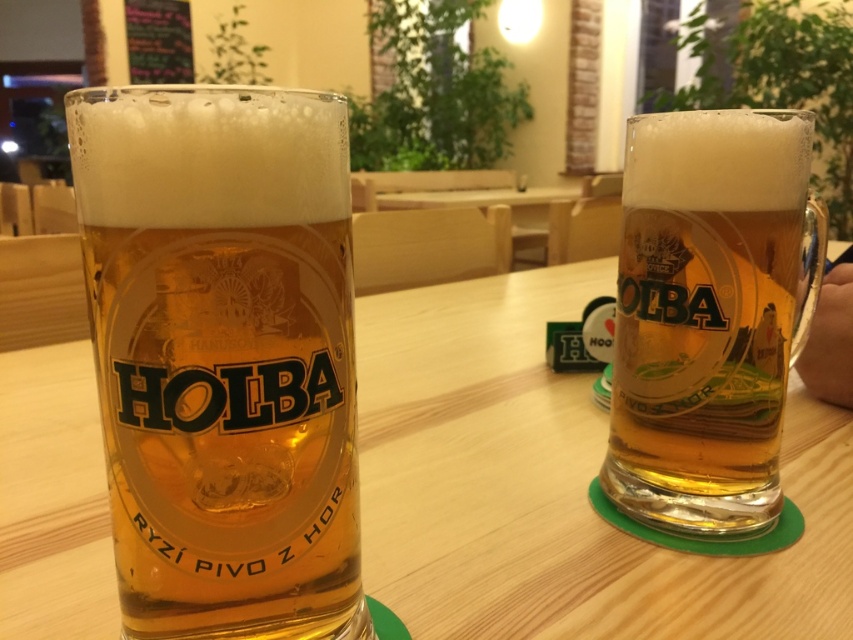
Question: Which object is farther from the camera taking this photo?

Choices:
 (A) translucent glass mug at center
 (B) translucent glass mug at right
 (C) wooden table at center

Answer: (B)

Question: Based on their relative distances, which object is nearer to the translucent glass mug at right?

Choices:
 (A) translucent glass mug at center
 (B) wooden table at center

Answer: (A)

Question: Can you confirm if wooden table at center is thinner than translucent glass mug at right?

Choices:
 (A) yes
 (B) no

Answer: (B)

Question: Is wooden table at center smaller than translucent glass mug at right?

Choices:
 (A) yes
 (B) no

Answer: (B)

Question: Which of the following is the closest to the observer?

Choices:
 (A) tap(766, 230)
 (B) tap(344, 410)
 (C) tap(486, 577)

Answer: (B)

Question: Is wooden table at center positioned at the back of translucent glass mug at right?

Choices:
 (A) yes
 (B) no

Answer: (B)